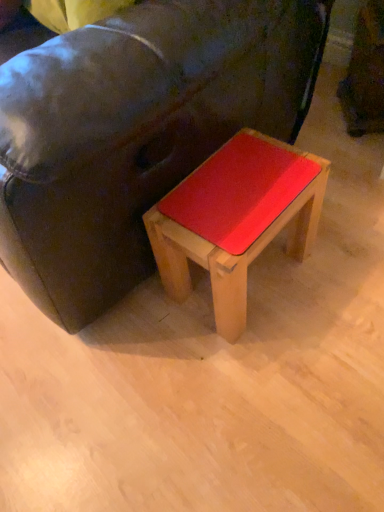
What is the approximate height of matte wood stool at center?

It is 13.43 inches.

This screenshot has height=512, width=384. What are the coordinates of `matte wood stool at center` in the screenshot? It's located at (235, 219).

This screenshot has width=384, height=512. What do you see at coordinates (235, 219) in the screenshot?
I see `matte wood stool at center` at bounding box center [235, 219].

Image resolution: width=384 pixels, height=512 pixels. I want to click on matte black couch at center, so click(x=135, y=132).

What do you see at coordinates (135, 132) in the screenshot? This screenshot has height=512, width=384. I see `matte black couch at center` at bounding box center [135, 132].

What are the coordinates of `matte wood stool at center` in the screenshot? It's located at (235, 219).

Visually, is matte wood stool at center positioned to the left or to the right of matte black couch at center?

Based on their positions, matte wood stool at center is located to the right of matte black couch at center.

Based on the photo, is matte wood stool at center in front of or behind matte black couch at center in the image?

Clearly, matte wood stool at center is behind matte black couch at center.

Which point is more forward, (311, 180) or (300, 36)?

The point (311, 180) is closer.

From the image's perspective, is matte wood stool at center beneath matte black couch at center?

Yes, from the image's perspective, matte wood stool at center is beneath matte black couch at center.

From a real-world perspective, relative to matte black couch at center, is matte wood stool at center vertically above or below?

From a real-world perspective, matte wood stool at center is physically below matte black couch at center.

Which object is thinner, matte wood stool at center or matte black couch at center?

matte wood stool at center is thinner.

Can you confirm if matte wood stool at center is shorter than matte black couch at center?

Yes, matte wood stool at center is shorter than matte black couch at center.

Based on the photo, based on their sizes in the image, would you say matte wood stool at center is bigger or smaller than matte black couch at center?

Clearly, matte wood stool at center is smaller in size than matte black couch at center.

Is matte wood stool at center outside of matte black couch at center?

matte wood stool at center is positioned outside matte black couch at center.

Would you consider matte wood stool at center to be distant from matte black couch at center?

No, matte wood stool at center is not far from matte black couch at center.

Is matte wood stool at center facing away from matte black couch at center?

matte wood stool at center is not turned away from matte black couch at center.

Can you tell me how much matte wood stool at center and matte black couch at center differ in facing direction?

They differ by 0.000589 degrees in their facing directions.

How distant is matte wood stool at center from matte black couch at center?

matte wood stool at center is 6.69 inches away from matte black couch at center.

At what (x,y) coordinates should I click in order to perform the action: click on stool on the right of the matte black couch at center. Please return your answer as a coordinate pair (x, y). The height and width of the screenshot is (512, 384). Looking at the image, I should click on (235, 219).

Is matte black couch at center to the left or to the right of matte wood stool at center in the image?

Clearly, matte black couch at center is on the left of matte wood stool at center in the image.

Does matte black couch at center lie behind matte wood stool at center?

No.

Considering the points (209, 125) and (171, 215), which point is behind, point (209, 125) or point (171, 215)?

The point (209, 125) is more distant.

From the image's perspective, relative to matte wood stool at center, is matte black couch at center above or below?

matte black couch at center is above matte wood stool at center.

From a real-world perspective, is matte black couch at center located beneath matte wood stool at center?

No, from a real-world perspective, matte black couch at center is not below matte wood stool at center.

Considering the sizes of objects matte black couch at center and matte wood stool at center in the image provided, who is wider, matte black couch at center or matte wood stool at center?

Wider between the two is matte black couch at center.

Is matte black couch at center taller or shorter than matte wood stool at center?

In the image, matte black couch at center appears to be taller than matte wood stool at center.

Is matte black couch at center bigger or smaller than matte wood stool at center?

Clearly, matte black couch at center is larger in size than matte wood stool at center.

Is matte black couch at center positioned beyond the bounds of matte wood stool at center?

Indeed, matte black couch at center is completely outside matte wood stool at center.

Is matte black couch at center far away from matte wood stool at center?

No, matte black couch at center is not far away from matte wood stool at center.

Is matte black couch at center aimed at matte wood stool at center?

No, matte black couch at center does not turn towards matte wood stool at center.

Identify the location of stool that appears below the matte black couch at center (from the image's perspective). (235, 219).

In order to click on stool behind the matte black couch at center in this screenshot , I will do `click(235, 219)`.

Locate an element on the screen. studio couch lying on the left of matte wood stool at center is located at coordinates (135, 132).